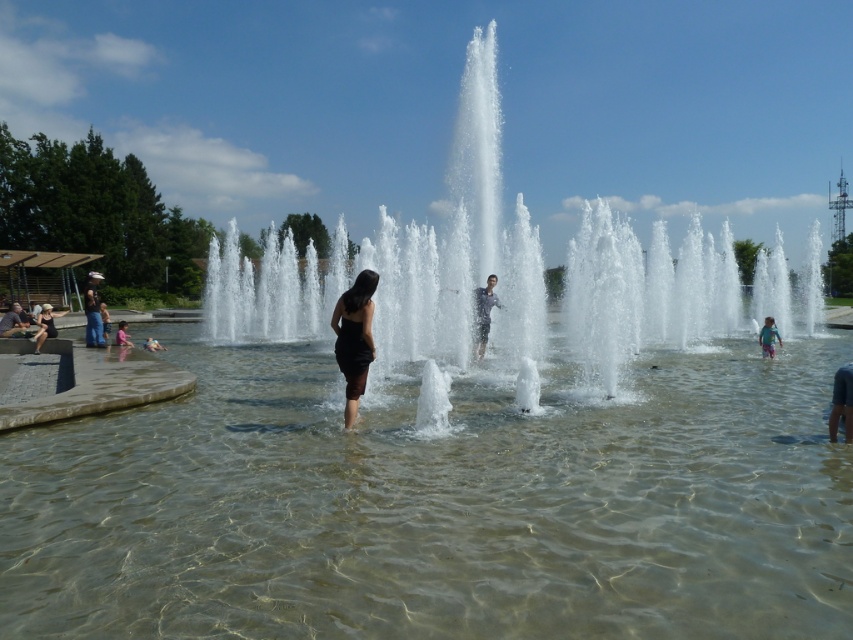
Is point (343, 376) closer to viewer compared to point (39, 340)?

Yes, point (343, 376) is closer to viewer.

The height and width of the screenshot is (640, 853). I want to click on black matte dress at center, so click(354, 339).

Is point (350, 298) behind point (44, 310)?

No, it is not.

Locate an element on the screen. Image resolution: width=853 pixels, height=640 pixels. black matte dress at center is located at coordinates (354, 339).

Does clear water at center appear under smooth gray shirt at center?

Yes, clear water at center is below smooth gray shirt at center.

Who is more forward, (65, 545) or (496, 280)?

Point (65, 545) is in front.

Where is `clear water at center`? The height and width of the screenshot is (640, 853). clear water at center is located at coordinates (437, 504).

Does black matte dress at center have a smaller size compared to blue denim shorts at lower right?

Incorrect, black matte dress at center is not smaller in size than blue denim shorts at lower right.

Is point (346, 314) closer to viewer compared to point (773, 355)?

Yes, point (346, 314) is closer to viewer.

I want to click on black matte dress at center, so click(354, 339).